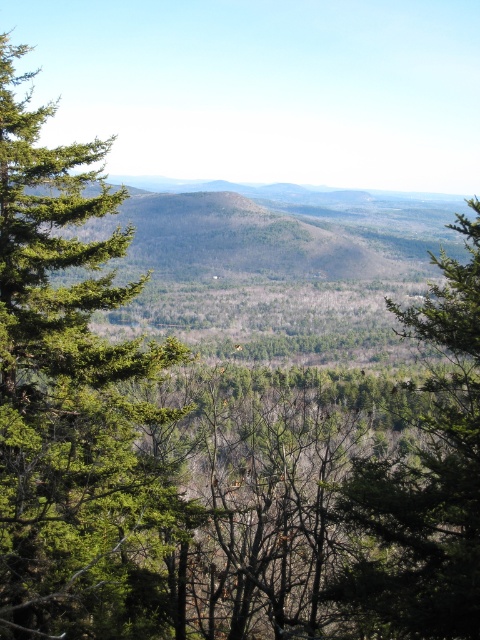
Question: Can you confirm if green needle-like tree at left is wider than green matte tree at center?

Choices:
 (A) no
 (B) yes

Answer: (A)

Question: Does green needle-like tree at left have a smaller size compared to green matte tree at center?

Choices:
 (A) no
 (B) yes

Answer: (A)

Question: Which point is closer to the camera?

Choices:
 (A) green matte tree at center
 (B) green needle-like tree at left

Answer: (B)

Question: Among these objects, which one is farthest from the camera?

Choices:
 (A) green matte tree at center
 (B) green needle-like tree at left

Answer: (A)

Question: Is green needle-like tree at left smaller than green matte tree at center?

Choices:
 (A) yes
 (B) no

Answer: (B)

Question: Which object appears farthest from the camera in this image?

Choices:
 (A) green needle-like tree at left
 (B) green matte tree at center

Answer: (B)